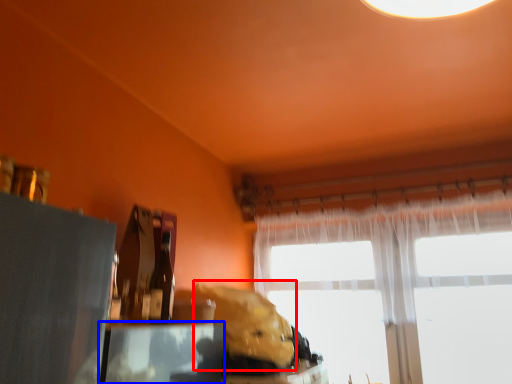
Question: Which object is further to the camera taking this photo, animal (highlighted by a red box) or table (highlighted by a blue box)?

Choices:
 (A) animal
 (B) table

Answer: (A)